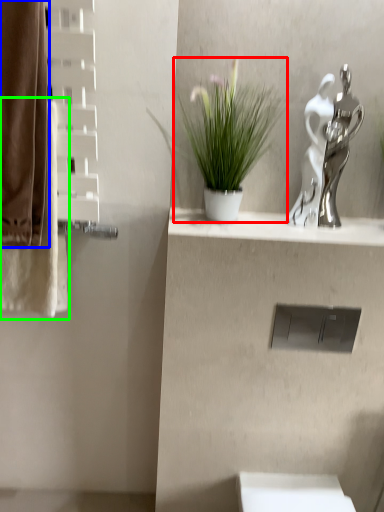
Question: Which object is the farthest from houseplant (highlighted by a red box)? Choose among these: curtain (highlighted by a blue box) or bath towel (highlighted by a green box).

Choices:
 (A) curtain
 (B) bath towel

Answer: (B)